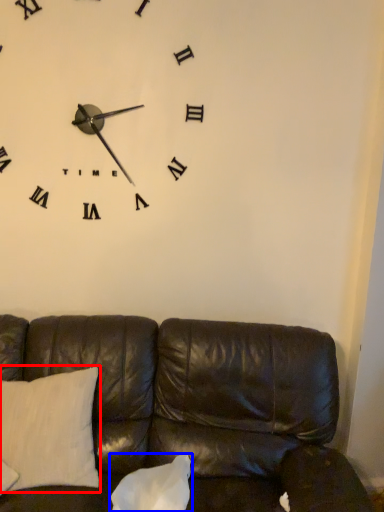
Question: Which object appears farthest to the camera in this image, pillow (highlighted by a red box) or pillow (highlighted by a blue box)?

Choices:
 (A) pillow
 (B) pillow

Answer: (A)